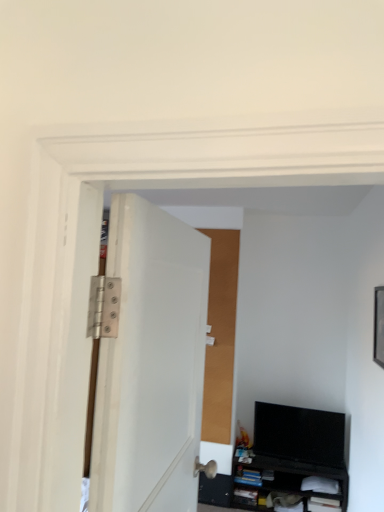
Question: Does black glossy tv at lower right come behind black matte cabinet at lower right?

Choices:
 (A) no
 (B) yes

Answer: (B)

Question: Is black glossy tv at lower right far from black matte cabinet at lower right?

Choices:
 (A) no
 (B) yes

Answer: (A)

Question: Is black glossy tv at lower right thinner than black matte cabinet at lower right?

Choices:
 (A) yes
 (B) no

Answer: (A)

Question: Is black glossy tv at lower right turned away from black matte cabinet at lower right?

Choices:
 (A) no
 (B) yes

Answer: (A)

Question: Is black glossy tv at lower right oriented towards black matte cabinet at lower right?

Choices:
 (A) no
 (B) yes

Answer: (A)

Question: Can you confirm if black glossy tv at lower right is taller than black matte cabinet at lower right?

Choices:
 (A) no
 (B) yes

Answer: (B)

Question: Can you confirm if white matte door at center is positioned to the left of black matte cabinet at lower right?

Choices:
 (A) yes
 (B) no

Answer: (A)

Question: From a real-world perspective, is white matte door at center under black matte cabinet at lower right?

Choices:
 (A) no
 (B) yes

Answer: (A)

Question: Can you confirm if white matte door at center is shorter than black matte cabinet at lower right?

Choices:
 (A) no
 (B) yes

Answer: (A)

Question: Does white matte door at center have a lesser width compared to black matte cabinet at lower right?

Choices:
 (A) yes
 (B) no

Answer: (A)

Question: From a real-world perspective, is white matte door at center located higher than black matte cabinet at lower right?

Choices:
 (A) yes
 (B) no

Answer: (A)

Question: Does white matte door at center appear on the right side of black matte cabinet at lower right?

Choices:
 (A) no
 (B) yes

Answer: (A)

Question: Is white matte door at center completely or partially inside black matte cabinet at lower right?

Choices:
 (A) no
 (B) yes

Answer: (A)